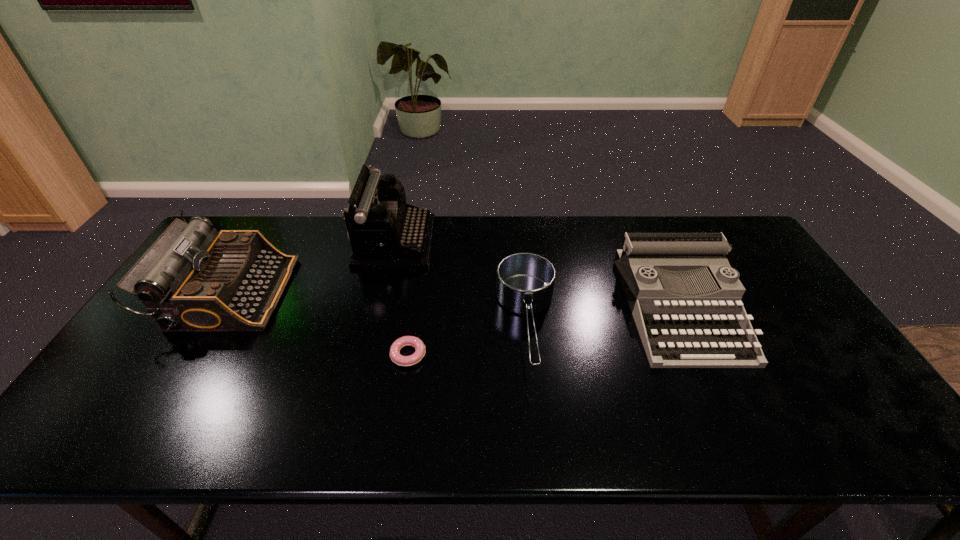
Find the location of `free space between the second tallest typewriter and the saucepan`. free space between the second tallest typewriter and the saucepan is located at coordinates (378, 308).

This screenshot has width=960, height=540. Identify the location of unoccupied area between the fourth tallest object and the shortest object. (468, 339).

Find the location of a particular element. Image resolution: width=960 pixels, height=540 pixels. vacant space that's between the second shortest object and the doughnut is located at coordinates (468, 339).

The width and height of the screenshot is (960, 540). In order to click on vacant space that is in between the leftmost typewriter and the shortest typewriter in this screenshot , I will do click(455, 300).

The height and width of the screenshot is (540, 960). In order to click on free area in between the saucepan and the fourth shortest object in this screenshot , I will do `click(378, 308)`.

Where is `vacant area between the fourth object from left to right and the doughnut`? This screenshot has height=540, width=960. vacant area between the fourth object from left to right and the doughnut is located at coordinates (468, 339).

This screenshot has height=540, width=960. Identify the location of free spot between the tallest typewriter and the second shortest object. (461, 282).

Find the location of a particular element. empty space that is in between the doughnut and the leftmost object is located at coordinates (319, 323).

This screenshot has height=540, width=960. Identify the location of empty space that is in between the rightmost object and the doughnut. (544, 332).

Where is `object that stands as the third closest to the saucepan`? The width and height of the screenshot is (960, 540). object that stands as the third closest to the saucepan is located at coordinates (385, 233).